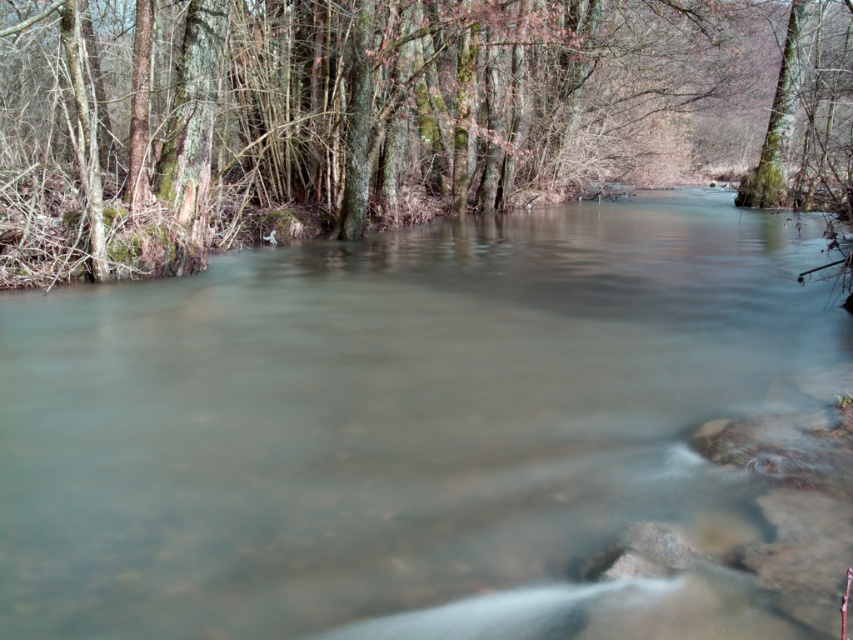
Question: Does clear water at center lie in front of green mossy tree at upper left?

Choices:
 (A) no
 (B) yes

Answer: (B)

Question: Which point is closer to the camera?

Choices:
 (A) (804, 48)
 (B) (216, 321)

Answer: (B)

Question: Among these objects, which one is farthest from the camera?

Choices:
 (A) clear water at center
 (B) green mossy tree at upper left

Answer: (B)

Question: Is clear water at center smaller than green mossy tree at upper left?

Choices:
 (A) yes
 (B) no

Answer: (A)

Question: Is the position of clear water at center more distant than that of green mossy tree at upper left?

Choices:
 (A) yes
 (B) no

Answer: (B)

Question: Which point is closer to the camera?

Choices:
 (A) (573, 80)
 (B) (218, 493)

Answer: (B)